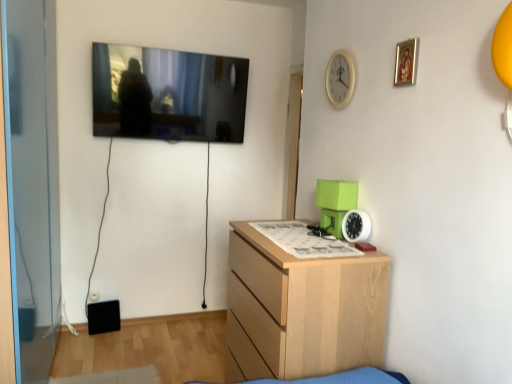
Question: Considering the relative sizes of white wooden clock at upper center, the second clock from the bottom, and flat screen tv at upper left in the image provided, is white wooden clock at upper center, the second clock from the bottom, smaller than flat screen tv at upper left?

Choices:
 (A) no
 (B) yes

Answer: (B)

Question: Is the position of white wooden clock at upper center, the second clock from the bottom, more distant than that of flat screen tv at upper left?

Choices:
 (A) no
 (B) yes

Answer: (A)

Question: Is white wooden clock at upper center, the second clock from the bottom, oriented away from flat screen tv at upper left?

Choices:
 (A) no
 (B) yes

Answer: (A)

Question: From the image's perspective, is white wooden clock at upper center, the 1th clock from the top, over flat screen tv at upper left?

Choices:
 (A) no
 (B) yes

Answer: (A)

Question: From a real-world perspective, is white wooden clock at upper center, the 1th clock from the top, located beneath flat screen tv at upper left?

Choices:
 (A) no
 (B) yes

Answer: (A)

Question: From a real-world perspective, relative to white wooden clock at upper center, the 1th clock from the top, is flat screen tv at upper left vertically above or below?

Choices:
 (A) below
 (B) above

Answer: (A)

Question: Is flat screen tv at upper left to the left or to the right of white wooden clock at upper center, the second clock from the bottom, in the image?

Choices:
 (A) right
 (B) left

Answer: (B)

Question: Relative to white wooden clock at upper center, the second clock from the bottom, is flat screen tv at upper left in front or behind?

Choices:
 (A) front
 (B) behind

Answer: (B)

Question: Considering the positions of point (117, 89) and point (334, 92), is point (117, 89) closer or farther from the camera than point (334, 92)?

Choices:
 (A) farther
 (B) closer

Answer: (A)

Question: From the image's perspective, is white plastic clock at right, arranged as the 2th clock when viewed from the top, positioned above or below gold-framed picture at upper right?

Choices:
 (A) below
 (B) above

Answer: (A)

Question: Considering the positions of point (365, 221) and point (404, 71), is point (365, 221) closer or farther from the camera than point (404, 71)?

Choices:
 (A) closer
 (B) farther

Answer: (B)

Question: Is white plastic clock at right, the 1th clock from the bottom, wider or thinner than gold-framed picture at upper right?

Choices:
 (A) thin
 (B) wide

Answer: (B)

Question: Based on their positions, is white plastic clock at right, the 1th clock from the bottom, located to the left or right of gold-framed picture at upper right?

Choices:
 (A) left
 (B) right

Answer: (A)

Question: Is point (415, 61) closer or farther from the camera than point (360, 225)?

Choices:
 (A) farther
 (B) closer

Answer: (B)

Question: In terms of width, does gold-framed picture at upper right look wider or thinner when compared to white plastic clock at right, arranged as the 2th clock when viewed from the top?

Choices:
 (A) thin
 (B) wide

Answer: (A)